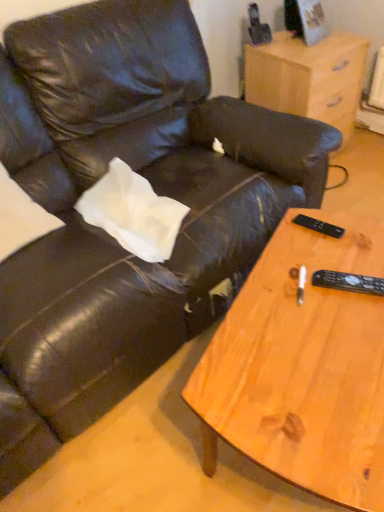
Find the location of `free space behind black plastic remote at right, acting as the 2th remote starting from the back`. free space behind black plastic remote at right, acting as the 2th remote starting from the back is located at coordinates (337, 249).